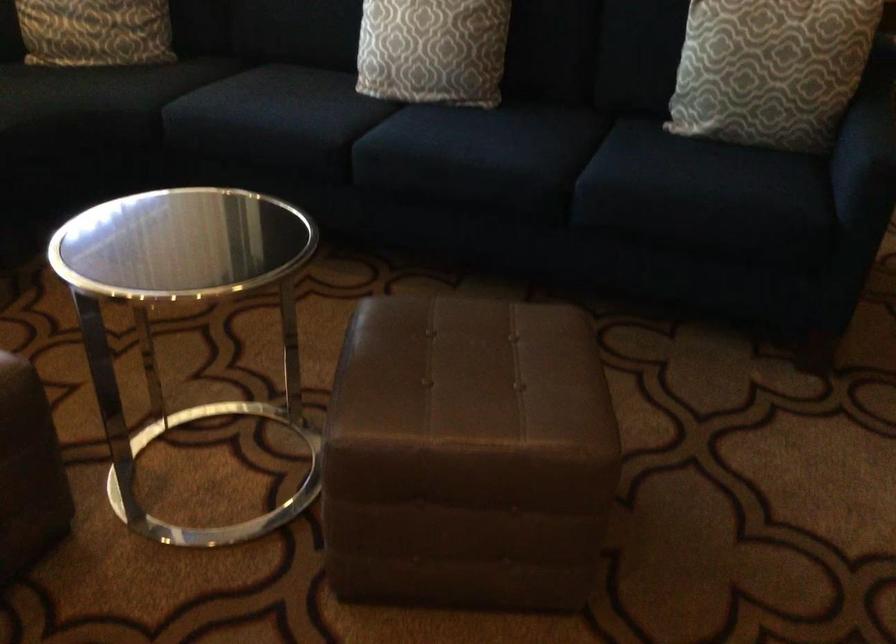
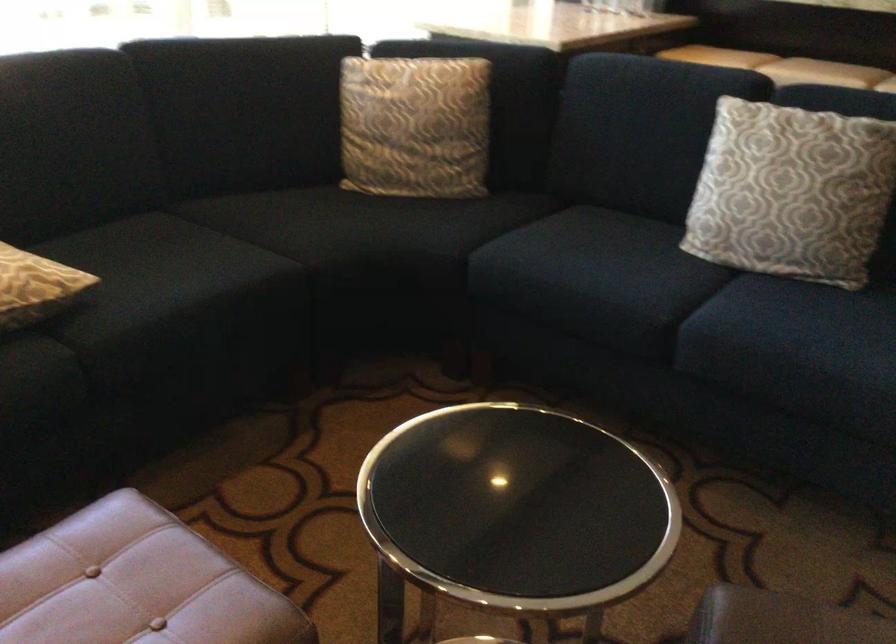
Locate, in the second image, the point that corresponds to (x=278, y=107) in the first image.

(590, 274)